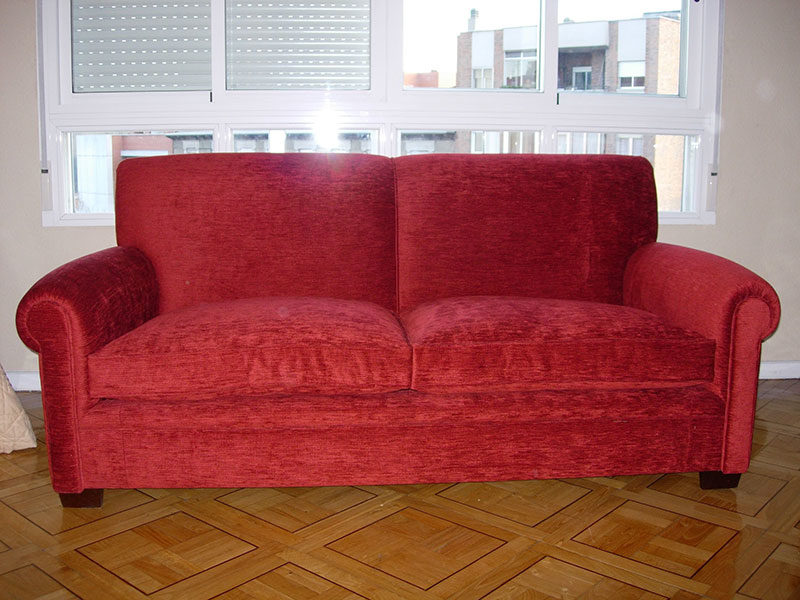
Locate an element on the screen. back wall is located at coordinates (761, 228), (14, 253).